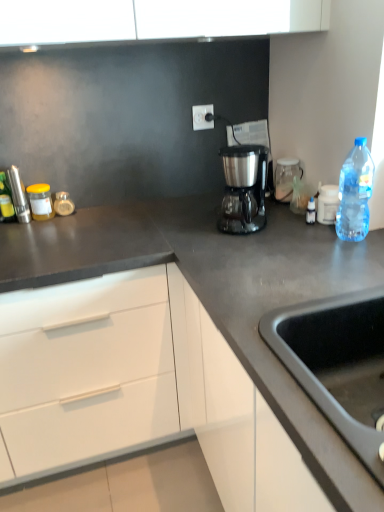
Locate an element on the screen. free space in front of matte yellow jar at left is located at coordinates (36, 230).